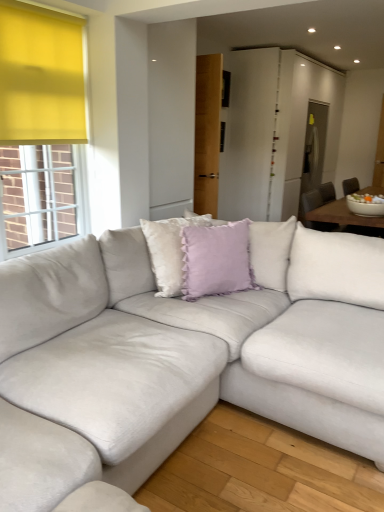
Question: Does lavender velvet cushion at center, the 2th pillow from the left, lie behind lavender velvet pillow at center, the second pillow when ordered from right to left?

Choices:
 (A) yes
 (B) no

Answer: (A)

Question: Does lavender velvet cushion at center, acting as the first pillow starting from the right, come in front of lavender velvet pillow at center, the second pillow when ordered from right to left?

Choices:
 (A) yes
 (B) no

Answer: (B)

Question: Is lavender velvet cushion at center, acting as the first pillow starting from the right, to the left of lavender velvet pillow at center, the second pillow when ordered from right to left, from the viewer's perspective?

Choices:
 (A) no
 (B) yes

Answer: (A)

Question: Is lavender velvet pillow at center, the 1th pillow from the left, surrounded by lavender velvet cushion at center, the 2th pillow from the left?

Choices:
 (A) yes
 (B) no

Answer: (B)

Question: Considering the relative sizes of lavender velvet cushion at center, acting as the first pillow starting from the right, and lavender velvet pillow at center, the second pillow when ordered from right to left, in the image provided, is lavender velvet cushion at center, acting as the first pillow starting from the right, bigger than lavender velvet pillow at center, the second pillow when ordered from right to left,?

Choices:
 (A) no
 (B) yes

Answer: (A)

Question: From the image's perspective, does lavender velvet cushion at center, acting as the first pillow starting from the right, appear lower than lavender velvet pillow at center, the 1th pillow from the left?

Choices:
 (A) no
 (B) yes

Answer: (B)

Question: Is suede white couch at center bigger than lavender velvet pillow at center, the 1th pillow from the left?

Choices:
 (A) yes
 (B) no

Answer: (A)

Question: Can you confirm if suede white couch at center is shorter than lavender velvet pillow at center, the second pillow when ordered from right to left?

Choices:
 (A) no
 (B) yes

Answer: (A)

Question: Is suede white couch at center aimed at lavender velvet pillow at center, the second pillow when ordered from right to left?

Choices:
 (A) yes
 (B) no

Answer: (A)

Question: Is suede white couch at center positioned with its back to lavender velvet pillow at center, the 1th pillow from the left?

Choices:
 (A) no
 (B) yes

Answer: (B)

Question: Is suede white couch at center completely or partially outside of lavender velvet pillow at center, the 1th pillow from the left?

Choices:
 (A) no
 (B) yes

Answer: (B)

Question: From a real-world perspective, does suede white couch at center stand above lavender velvet pillow at center, the 1th pillow from the left?

Choices:
 (A) no
 (B) yes

Answer: (A)

Question: Can you confirm if suede white couch at center is taller than lavender velvet cushion at center, the 2th pillow from the left?

Choices:
 (A) yes
 (B) no

Answer: (A)